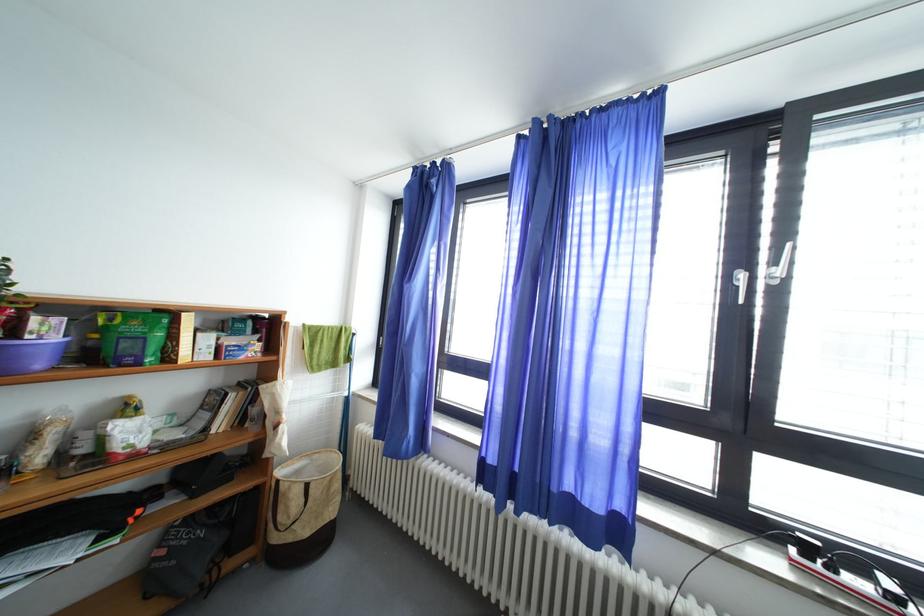
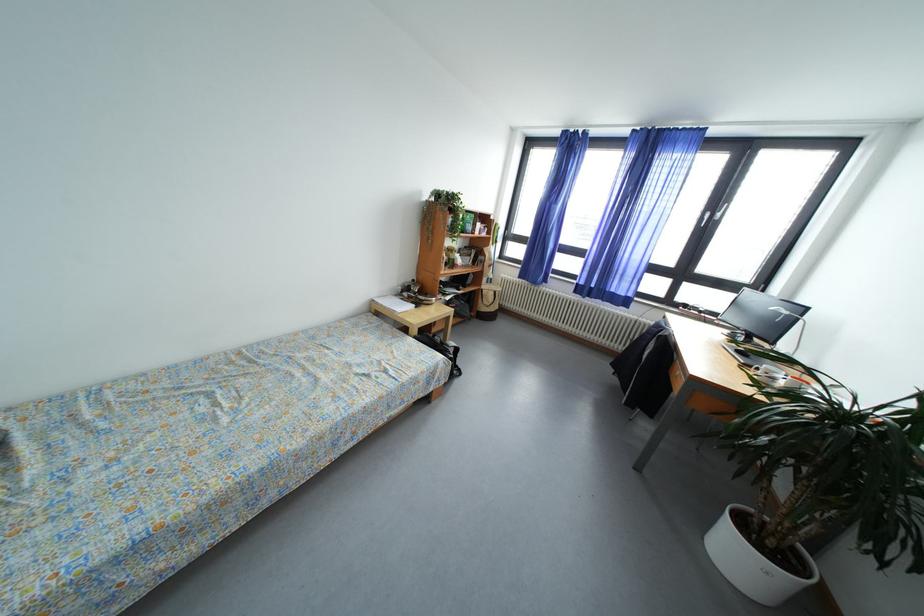
Where in the second image is the point corresponding to (313,490) from the first image?

(502, 297)